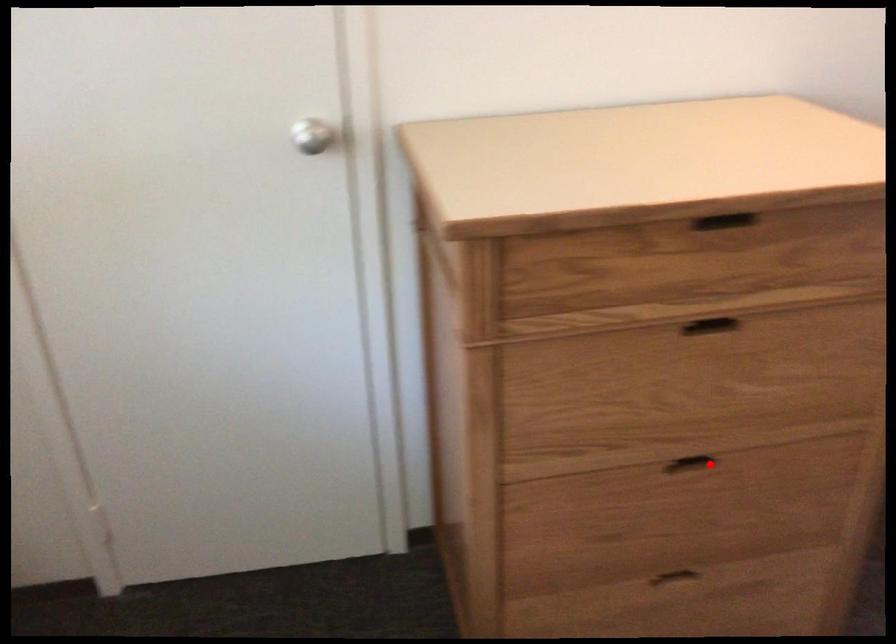
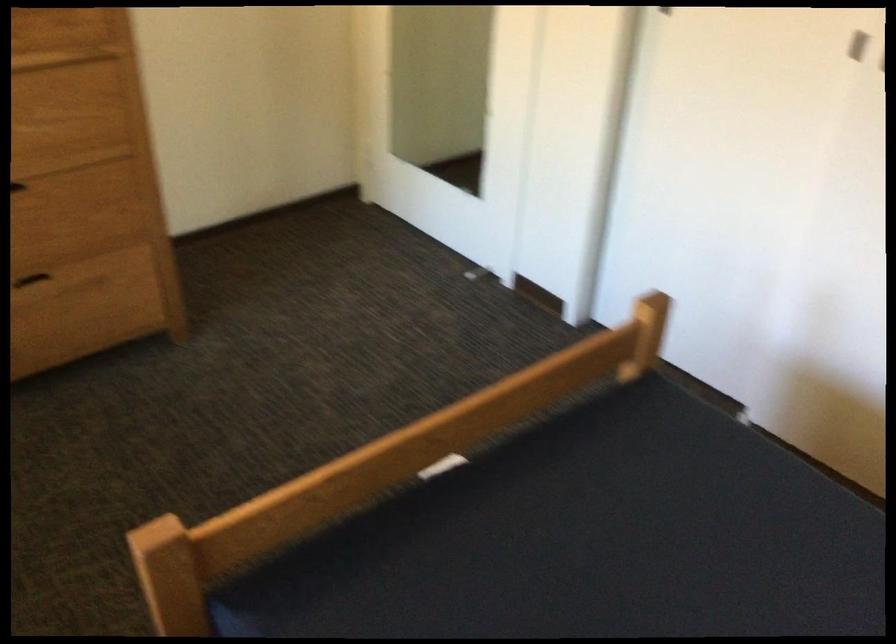
Locate, in the second image, the point that corresponds to the highlighted location in the first image.

(19, 187)